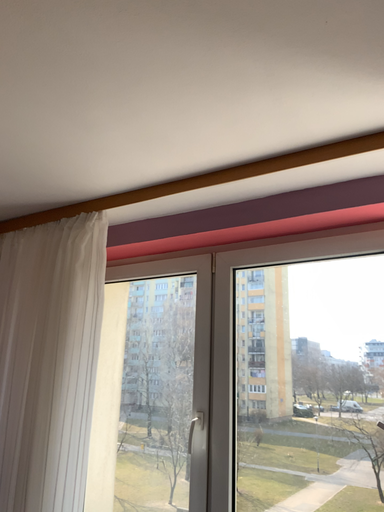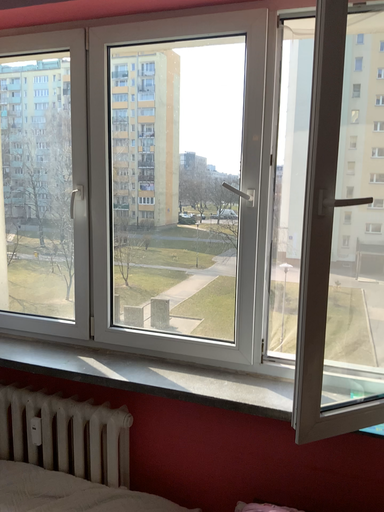
Question: How did the camera likely rotate when shooting the video?

Choices:
 (A) rotated upward
 (B) rotated downward

Answer: (B)